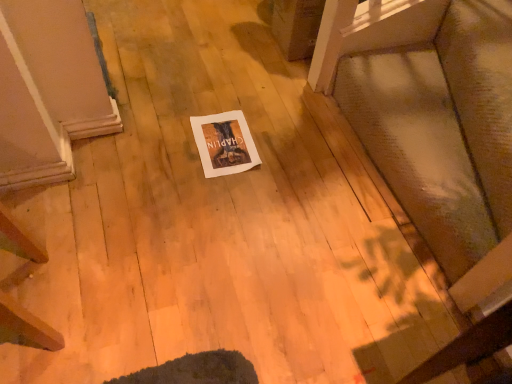
Question: Is textured fabric cushion at lower right taller than white paper at center?

Choices:
 (A) yes
 (B) no

Answer: (A)

Question: Are textured fabric cushion at lower right and white paper at center far apart?

Choices:
 (A) yes
 (B) no

Answer: (B)

Question: Can you confirm if textured fabric cushion at lower right is thinner than white paper at center?

Choices:
 (A) no
 (B) yes

Answer: (A)

Question: Are textured fabric cushion at lower right and white paper at center beside each other?

Choices:
 (A) no
 (B) yes

Answer: (A)

Question: Could you tell me if textured fabric cushion at lower right is facing white paper at center?

Choices:
 (A) no
 (B) yes

Answer: (B)

Question: Is textured fabric cushion at lower right shorter than white paper at center?

Choices:
 (A) yes
 (B) no

Answer: (B)

Question: Can you see white paper at center touching textured fabric cushion at lower right?

Choices:
 (A) no
 (B) yes

Answer: (A)

Question: Can you confirm if white paper at center is positioned to the left of textured fabric cushion at lower right?

Choices:
 (A) yes
 (B) no

Answer: (A)

Question: Is white paper at center to the right of textured fabric cushion at lower right from the viewer's perspective?

Choices:
 (A) no
 (B) yes

Answer: (A)

Question: Does white paper at center come behind textured fabric cushion at lower right?

Choices:
 (A) yes
 (B) no

Answer: (A)

Question: Is white paper at center wider than textured fabric cushion at lower right?

Choices:
 (A) no
 (B) yes

Answer: (A)

Question: Can you confirm if white paper at center is shorter than textured fabric cushion at lower right?

Choices:
 (A) yes
 (B) no

Answer: (A)

Question: Relative to white paper at center, is textured fabric cushion at lower right in front or behind?

Choices:
 (A) front
 (B) behind

Answer: (A)